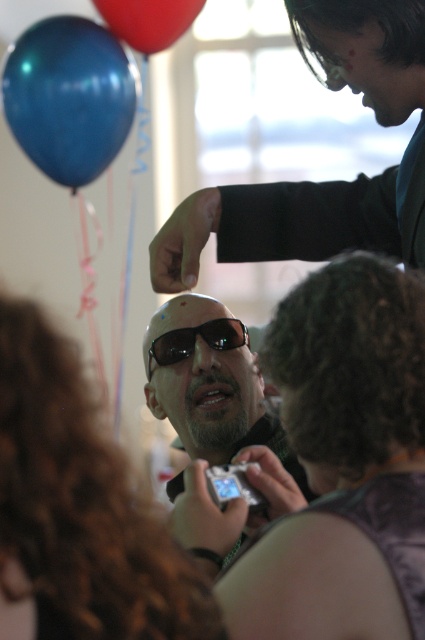
Where is `matte purple tank top at center`? matte purple tank top at center is located at coordinates (343, 461).

Is matte purple tank top at center wider than shiny black sunglasses at upper center?

In fact, matte purple tank top at center might be narrower than shiny black sunglasses at upper center.

Where is `matte purple tank top at center`? matte purple tank top at center is located at coordinates (343, 461).

This screenshot has height=640, width=425. I want to click on matte purple tank top at center, so click(x=343, y=461).

Who is more distant from viewer, (345, 563) or (87, 637)?

Positioned behind is point (345, 563).

Can you confirm if matte purple tank top at center is positioned above curly hair at center?

No.

Is point (401, 525) closer to viewer compared to point (79, 632)?

No, (401, 525) is behind (79, 632).

Where is `matte purple tank top at center`? This screenshot has width=425, height=640. matte purple tank top at center is located at coordinates (343, 461).

Is matte purple tank top at center above shiny red balloon at upper left?

→ Incorrect, matte purple tank top at center is not positioned above shiny red balloon at upper left.

The width and height of the screenshot is (425, 640). Identify the location of matte purple tank top at center. (343, 461).